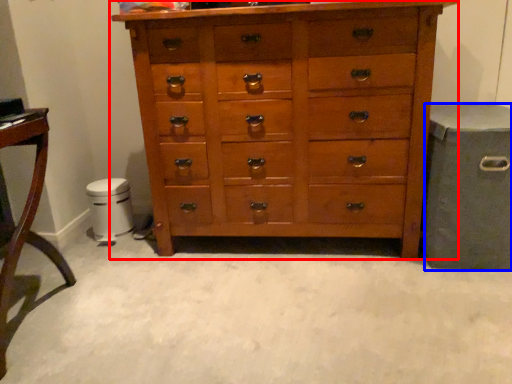
Question: Which point is further to the camera, chest of drawers (highlighted by a red box) or gray (highlighted by a blue box)?

Choices:
 (A) chest of drawers
 (B) gray

Answer: (B)